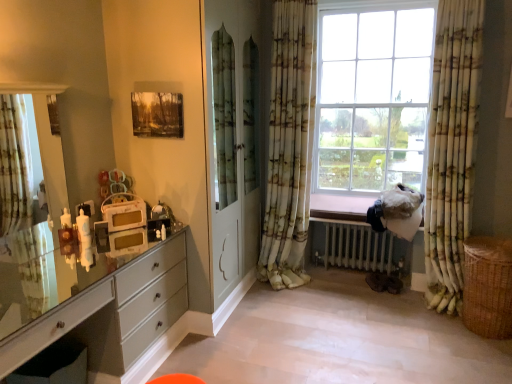
Image resolution: width=512 pixels, height=384 pixels. Find the location of `free spot above braided wicker basket at lower right (from a real-world perspective)`. free spot above braided wicker basket at lower right (from a real-world perspective) is located at coordinates (490, 248).